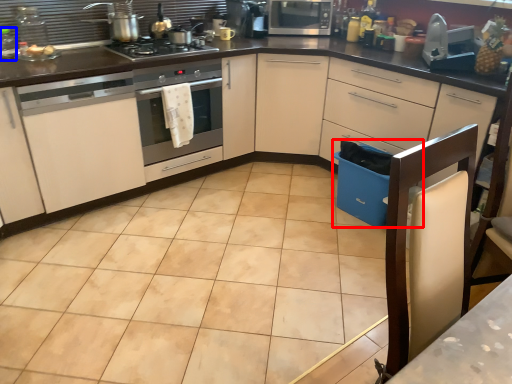
Question: Among these objects, which one is nearest to the camera, dish washer (highlighted by a red box) or appliance (highlighted by a blue box)?

Choices:
 (A) dish washer
 (B) appliance

Answer: (B)